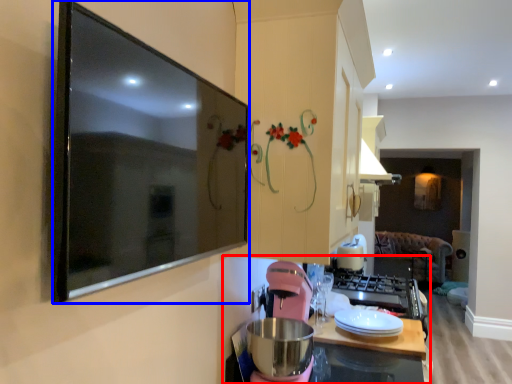
Question: Which object appears closest to the camera in this image, countertop (highlighted by a red box) or picture frame (highlighted by a blue box)?

Choices:
 (A) countertop
 (B) picture frame

Answer: (B)